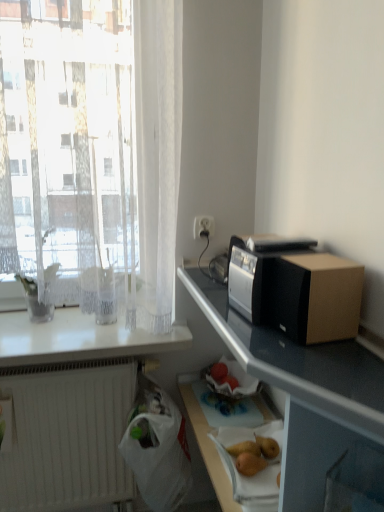
Find the location of a particular element. Image resolution: width=384 pixels, height=512 pixels. free space in front of smooth brown pear at lower center is located at coordinates (257, 494).